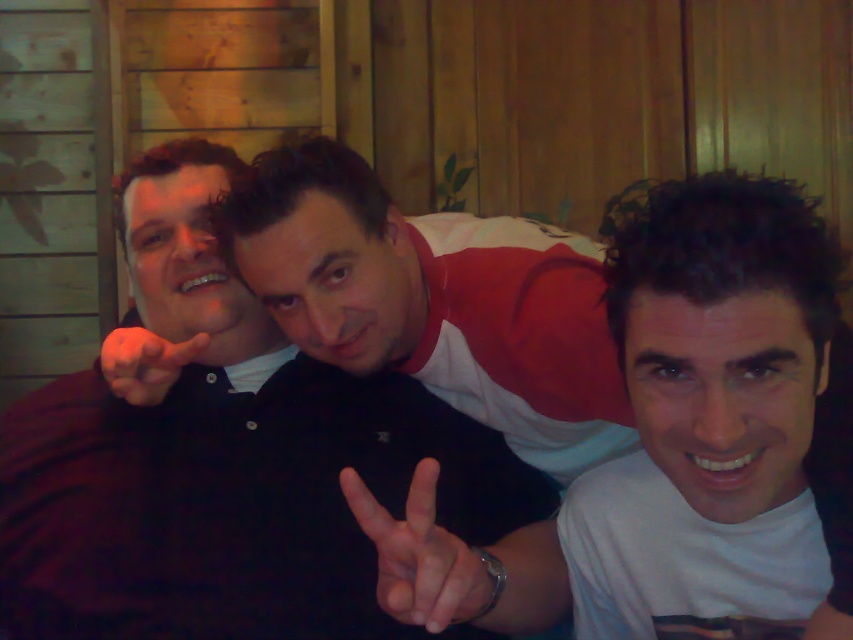
Can you confirm if black matte shirt at center is smaller than smooth skin hand at center?

Actually, black matte shirt at center might be larger than smooth skin hand at center.

Is point (294, 486) closer to viewer compared to point (160, 396)?

No, it is not.

Identify the location of black matte shirt at center. The width and height of the screenshot is (853, 640). (224, 461).

Is point (62, 566) farther from viewer compared to point (612, 484)?

Yes, it is.

Describe the element at coordinates (224, 461) in the screenshot. I see `black matte shirt at center` at that location.

Identify the location of black matte shirt at center. (224, 461).

Where is `black matte shirt at center`? black matte shirt at center is located at coordinates (224, 461).

Between white matte shirt at center and white matte hand at center, which one has less height?

white matte hand at center

In order to click on white matte shirt at center in this screenshot , I will do `click(721, 426)`.